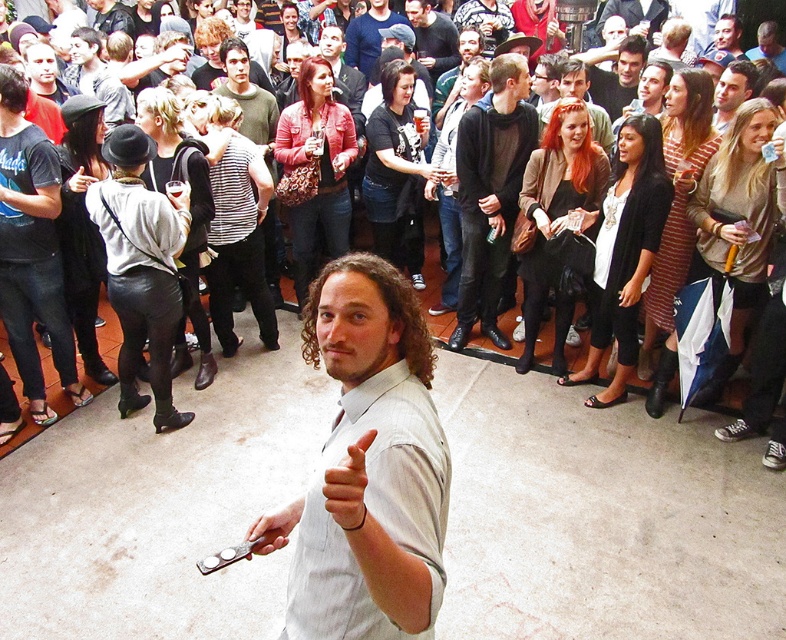
Who is higher up, light gray shirt at center or dark gray sweater at center?

dark gray sweater at center

Does point (441, 500) lie in front of point (412, 4)?

Yes, it is in front of point (412, 4).

Which is behind, point (379, 481) or point (434, 67)?

The point (434, 67) is behind.

Where is `light gray shirt at center`? The height and width of the screenshot is (640, 786). light gray shirt at center is located at coordinates (368, 465).

Between light gray shirt at center and black leather pants at center, which one is positioned lower?

light gray shirt at center

Does light gray shirt at center appear on the left side of black leather pants at center?

Correct, you'll find light gray shirt at center to the left of black leather pants at center.

Does point (393, 490) lie behind point (465, 227)?

No, it is in front of (465, 227).

Locate an element on the screen. light gray shirt at center is located at coordinates (368, 465).

Is point (13, 308) positioned before point (638, 35)?

That is True.

Between leather pants at left and smooth black shirt at center, which one appears on the left side from the viewer's perspective?

Positioned to the left is leather pants at left.

Identify the location of leather pants at left. (31, 250).